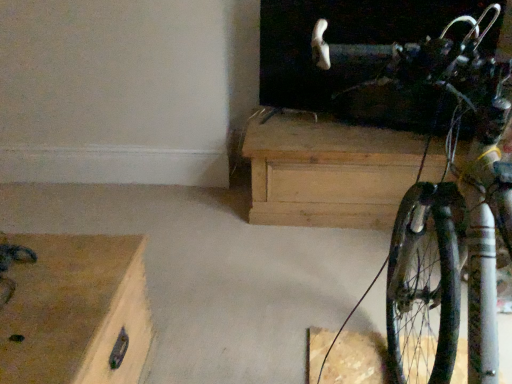
Locate an element on the screen. The height and width of the screenshot is (384, 512). empty space that is ontop of wooden chest at lower left, the 2th chest of drawers viewed from the right is located at coordinates (45, 276).